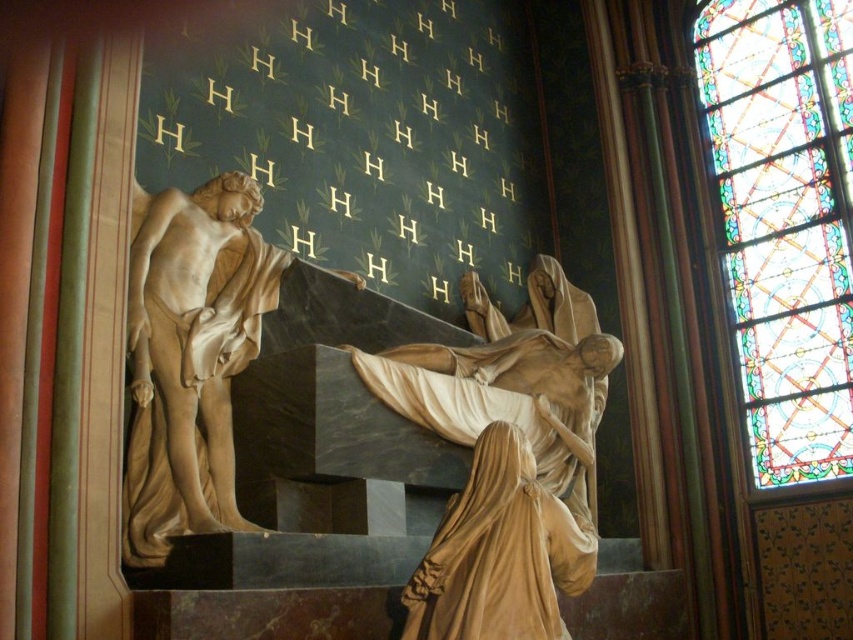
Is point (223, 320) positioned before point (498, 584)?

No, it is behind (498, 584).

Is marble statue at center smaller than smooth beige cloth at center?

Incorrect, marble statue at center is not smaller in size than smooth beige cloth at center.

Locate an element on the screen. The width and height of the screenshot is (853, 640). marble statue at center is located at coordinates (190, 356).

Is point (544, 413) farther from camera compared to point (531, 474)?

Yes, point (544, 413) is behind point (531, 474).

This screenshot has height=640, width=853. What do you see at coordinates (509, 376) in the screenshot?
I see `matte gold statue at center` at bounding box center [509, 376].

Measure the distance between point [492,413] and camera.

They are 48.85 meters apart.

Image resolution: width=853 pixels, height=640 pixels. Find the location of `matte gold statue at center`. matte gold statue at center is located at coordinates (509, 376).

Which of these two, marble statue at center or matte gold statue at center, stands taller?

Standing taller between the two is matte gold statue at center.

Is point (223, 502) closer to camera compared to point (601, 339)?

Yes, point (223, 502) is closer to viewer.

In order to click on marble statue at center in this screenshot , I will do `click(190, 356)`.